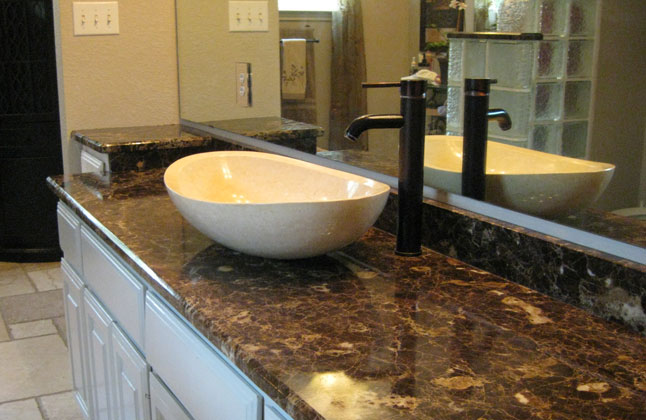
Locate an element on the screen. tile floor is located at coordinates (46, 360).